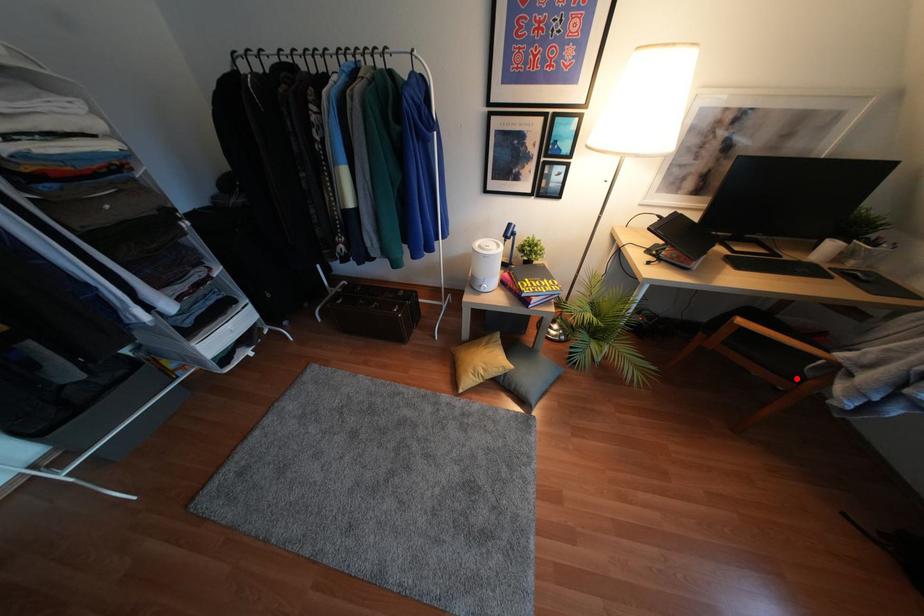
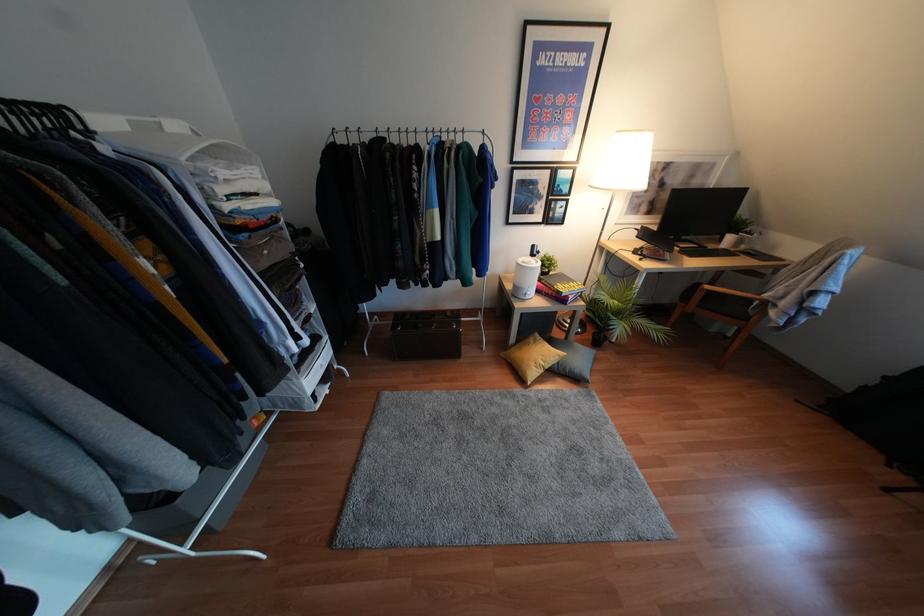
Question: I am providing you with two images of the same scene from different viewpoints. A red point is shown in image1. For the corresponding object point in image2, is it positioned nearer or farther from the camera?

Choices:
 (A) Nearer
 (B) Farther

Answer: (A)